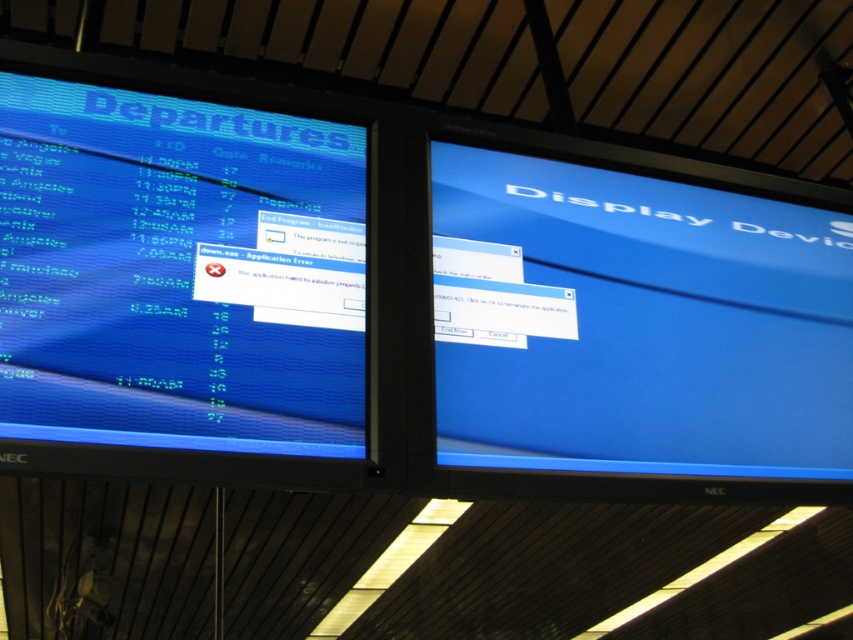
Which of these two, matte blue display at left or blue glossy monitor at center, stands shorter?

Standing shorter between the two is matte blue display at left.

Image resolution: width=853 pixels, height=640 pixels. I want to click on matte blue display at left, so click(178, 284).

You are a GUI agent. You are given a task and a screenshot of the screen. Output one action in this format:
    pyautogui.click(x=<x>, y=<y>)
    Task: Click on the matte blue display at left
    The width and height of the screenshot is (853, 640).
    Given the screenshot: What is the action you would take?
    pyautogui.click(x=178, y=284)